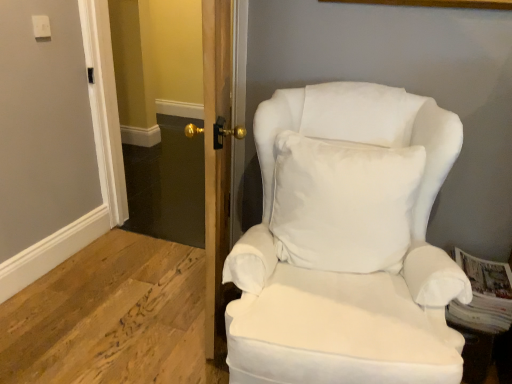
Question: Considering the positions of clear glass door at center and white fabric chair at right in the image, is clear glass door at center wider or thinner than white fabric chair at right?

Choices:
 (A) wide
 (B) thin

Answer: (B)

Question: Looking at the image, does clear glass door at center seem bigger or smaller compared to white fabric chair at right?

Choices:
 (A) big
 (B) small

Answer: (B)

Question: Estimate the real-world distances between objects in this image. Which object is closer to the clear glass door at center?

Choices:
 (A) wooden door at center
 (B) white soft cushion at center
 (C) white fabric chair at right

Answer: (C)

Question: Estimate the real-world distances between objects in this image. Which object is farther from the white fabric chair at right?

Choices:
 (A) wooden door at center
 (B) white soft cushion at center
 (C) clear glass door at center

Answer: (C)